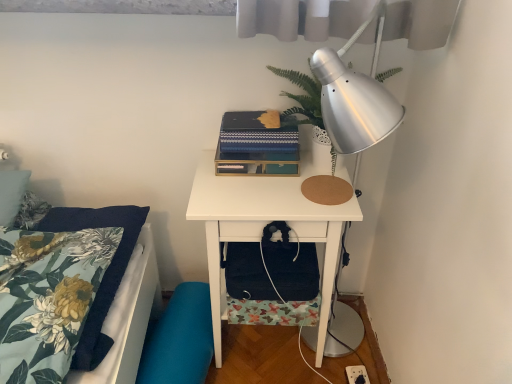
Question: Is the position of white matte nightstand at center more distant than that of blue textured book at center?

Choices:
 (A) yes
 (B) no

Answer: (B)

Question: Would you say white matte nightstand at center contains blue textured book at center?

Choices:
 (A) yes
 (B) no

Answer: (B)

Question: Considering the relative positions of white matte nightstand at center and blue textured book at center in the image provided, is white matte nightstand at center in front of blue textured book at center?

Choices:
 (A) yes
 (B) no

Answer: (A)

Question: Does white matte nightstand at center have a larger size compared to blue textured book at center?

Choices:
 (A) yes
 (B) no

Answer: (A)

Question: Is white matte nightstand at center not within blue textured book at center?

Choices:
 (A) no
 (B) yes

Answer: (B)

Question: Is white matte nightstand at center not near blue textured book at center?

Choices:
 (A) no
 (B) yes

Answer: (A)

Question: Would you say white matte nightstand at center is part of white plastic electric outlet at lower right's contents?

Choices:
 (A) no
 (B) yes

Answer: (A)

Question: From the image's perspective, is white plastic electric outlet at lower right over white matte nightstand at center?

Choices:
 (A) no
 (B) yes

Answer: (A)

Question: Is white plastic electric outlet at lower right outside of white matte nightstand at center?

Choices:
 (A) yes
 (B) no

Answer: (A)

Question: Can you confirm if white plastic electric outlet at lower right is thinner than white matte nightstand at center?

Choices:
 (A) no
 (B) yes

Answer: (B)

Question: From a real-world perspective, is white plastic electric outlet at lower right below white matte nightstand at center?

Choices:
 (A) yes
 (B) no

Answer: (A)

Question: From a real-world perspective, is white plastic electric outlet at lower right physically above white matte nightstand at center?

Choices:
 (A) yes
 (B) no

Answer: (B)

Question: From the image's perspective, is teal fabric swivel chair at lower left located beneath blue textured book at center?

Choices:
 (A) no
 (B) yes

Answer: (B)